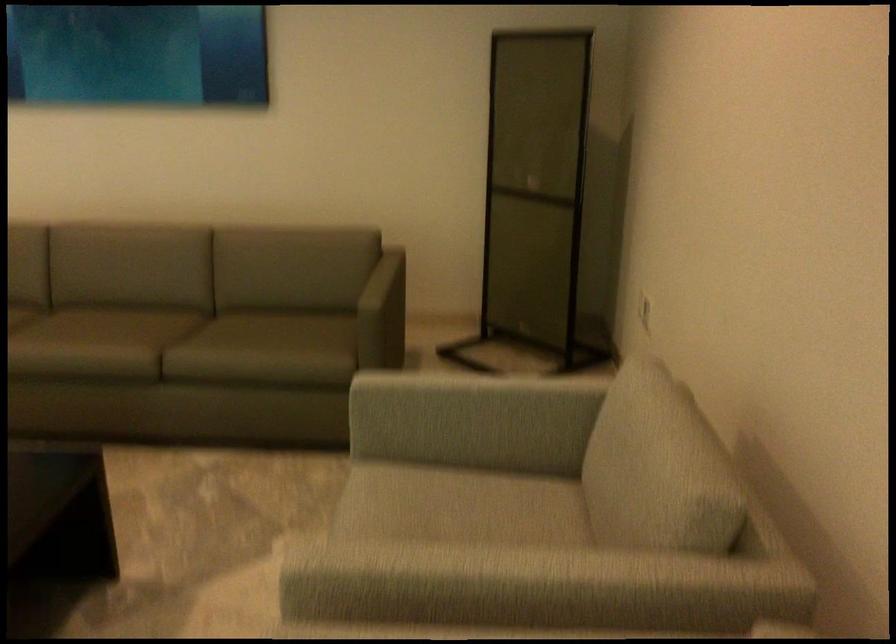
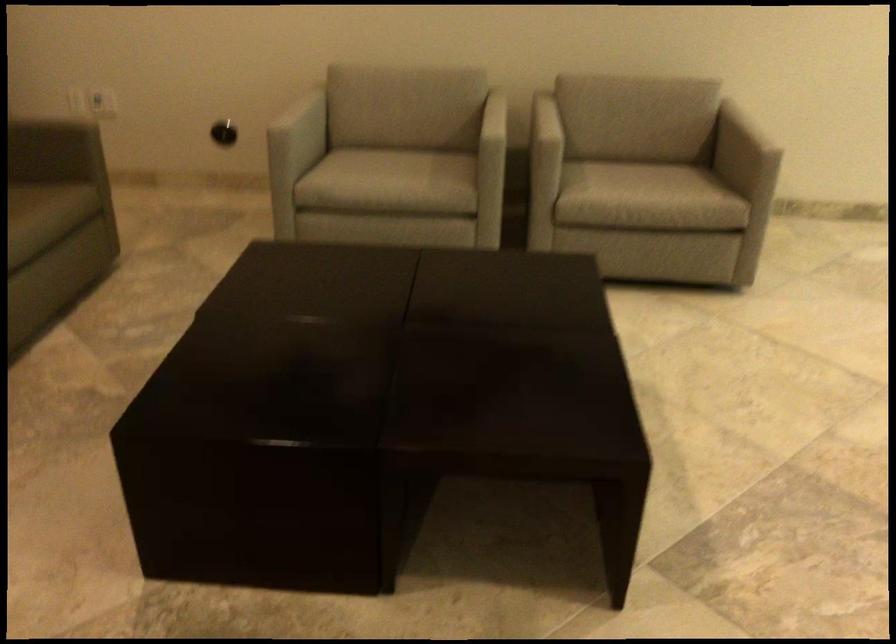
Locate, in the second image, the point that corresponds to point 273,368 in the first image.

(36, 219)